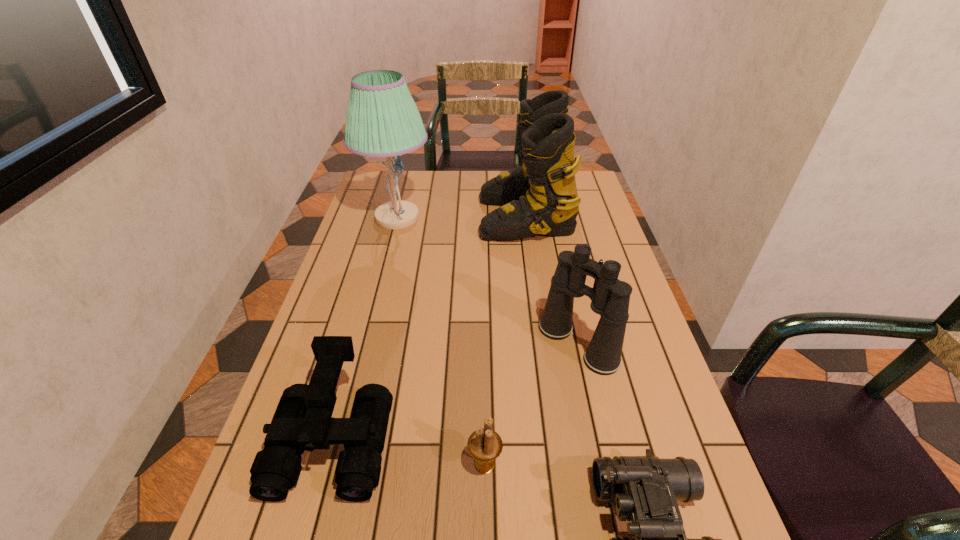
Where is `lamp present at the far edge`? This screenshot has width=960, height=540. lamp present at the far edge is located at coordinates (382, 120).

Image resolution: width=960 pixels, height=540 pixels. I want to click on ski boots that is at the far edge, so click(x=540, y=197).

What are the coordinates of `lamp that is positioned at the left edge` in the screenshot? It's located at [x=382, y=120].

The height and width of the screenshot is (540, 960). Find the location of `binoculars at the left edge`. binoculars at the left edge is located at coordinates (303, 421).

You are a GUI agent. You are given a task and a screenshot of the screen. Output one action in this format:
    pyautogui.click(x=<x>, y=<y>)
    Task: Click on the ski boots located at the right edge
    The height and width of the screenshot is (540, 960).
    Given the screenshot: What is the action you would take?
    pyautogui.click(x=540, y=197)

This screenshot has width=960, height=540. I want to click on binoculars present at the right edge, so click(610, 297).

Identify the location of object located at the far left corner. The height and width of the screenshot is (540, 960). 382,120.

Where is `object situated at the far right corner`? The image size is (960, 540). object situated at the far right corner is located at coordinates (540, 197).

Where is `vacant area at the far edge`? The width and height of the screenshot is (960, 540). vacant area at the far edge is located at coordinates (461, 177).

Find the location of `vacant space at the left edge of the desktop`. vacant space at the left edge of the desktop is located at coordinates pyautogui.click(x=343, y=265).